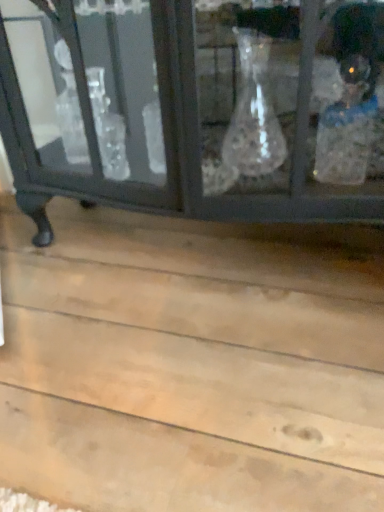
Where is `natural wood plank at lower center`? Image resolution: width=384 pixels, height=512 pixels. natural wood plank at lower center is located at coordinates [x=201, y=385].

Describe the element at coordinates (201, 385) in the screenshot. I see `natural wood plank at lower center` at that location.

Find the location of a particular element. The width and height of the screenshot is (384, 512). matte black cabinet at upper center is located at coordinates (195, 108).

The width and height of the screenshot is (384, 512). What do you see at coordinates (195, 108) in the screenshot? I see `matte black cabinet at upper center` at bounding box center [195, 108].

The height and width of the screenshot is (512, 384). What are the coordinates of `natural wood plank at lower center` in the screenshot? It's located at click(x=201, y=385).

Considering the relative positions of natural wood plank at lower center and matte black cabinet at upper center in the image provided, is natural wood plank at lower center to the left of matte black cabinet at upper center from the viewer's perspective?

Indeed, natural wood plank at lower center is positioned on the left side of matte black cabinet at upper center.

From the picture: Does natural wood plank at lower center lie behind matte black cabinet at upper center?

No, natural wood plank at lower center is closer to the camera.

Does point (307, 385) appear closer or farther from the camera than point (15, 181)?

Clearly, point (307, 385) is closer to the camera than point (15, 181).

From the image's perspective, is natural wood plank at lower center located above matte black cabinet at upper center?

No.

From a real-world perspective, between natural wood plank at lower center and matte black cabinet at upper center, who is vertically higher?

From a 3D spatial view, matte black cabinet at upper center is above.

Can you confirm if natural wood plank at lower center is thinner than matte black cabinet at upper center?

No.

Which of these two, natural wood plank at lower center or matte black cabinet at upper center, stands shorter?

With less height is natural wood plank at lower center.

Between natural wood plank at lower center and matte black cabinet at upper center, which one has smaller size?

natural wood plank at lower center.

Is natural wood plank at lower center completely or partially outside of matte black cabinet at upper center?

Yes, natural wood plank at lower center is outside of matte black cabinet at upper center.

Is natural wood plank at lower center far from matte black cabinet at upper center?

That's not correct — natural wood plank at lower center is a little close to matte black cabinet at upper center.

Is natural wood plank at lower center positioned with its back to matte black cabinet at upper center?

No, natural wood plank at lower center's orientation is not away from matte black cabinet at upper center.

In the scene shown: What's the angular difference between natural wood plank at lower center and matte black cabinet at upper center's facing directions?

The facing directions of natural wood plank at lower center and matte black cabinet at upper center are 180 degrees apart.

Measure the distance between natural wood plank at lower center and matte black cabinet at upper center.

A distance of 17.84 inches exists between natural wood plank at lower center and matte black cabinet at upper center.

Locate an element on the screen. plank that appears below the matte black cabinet at upper center (from the image's perspective) is located at coordinates (201, 385).

Visually, is matte black cabinet at upper center positioned to the left or to the right of natural wood plank at lower center?

In the image, matte black cabinet at upper center appears on the right side of natural wood plank at lower center.

Based on the photo, is matte black cabinet at upper center behind natural wood plank at lower center?

Yes, the depth of matte black cabinet at upper center is greater than that of natural wood plank at lower center.

Which is closer to the camera, (99,54) or (273,447)?

Point (99,54) appears to be farther away from the viewer than point (273,447).

From the image's perspective, is matte black cabinet at upper center on natural wood plank at lower center?

Indeed, from the image's perspective, matte black cabinet at upper center is shown above natural wood plank at lower center.

From a real-world perspective, which object rests below the other?

In real-world perspective, natural wood plank at lower center is lower.

Is matte black cabinet at upper center wider or thinner than natural wood plank at lower center?

Clearly, matte black cabinet at upper center has less width compared to natural wood plank at lower center.

In the scene shown: Between matte black cabinet at upper center and natural wood plank at lower center, which one has more height?

Standing taller between the two is matte black cabinet at upper center.

Between matte black cabinet at upper center and natural wood plank at lower center, which one has smaller size?

natural wood plank at lower center is smaller.

Is matte black cabinet at upper center not within natural wood plank at lower center?

Yes, matte black cabinet at upper center is not within natural wood plank at lower center.

Are matte black cabinet at upper center and natural wood plank at lower center far apart?

No, matte black cabinet at upper center is in close proximity to natural wood plank at lower center.

Is matte black cabinet at upper center oriented towards natural wood plank at lower center?

No, matte black cabinet at upper center is not oriented towards natural wood plank at lower center.

What's the angular difference between matte black cabinet at upper center and natural wood plank at lower center's facing directions?

180 degrees.

The height and width of the screenshot is (512, 384). I want to click on plank lying below the matte black cabinet at upper center (from the image's perspective), so click(201, 385).

Where is `furniture above the natural wood plank at lower center (from the image's perspective)`? The image size is (384, 512). furniture above the natural wood plank at lower center (from the image's perspective) is located at coordinates (195, 108).

Where is `plank located underneath the matte black cabinet at upper center (from a real-world perspective)`? plank located underneath the matte black cabinet at upper center (from a real-world perspective) is located at coordinates (201, 385).